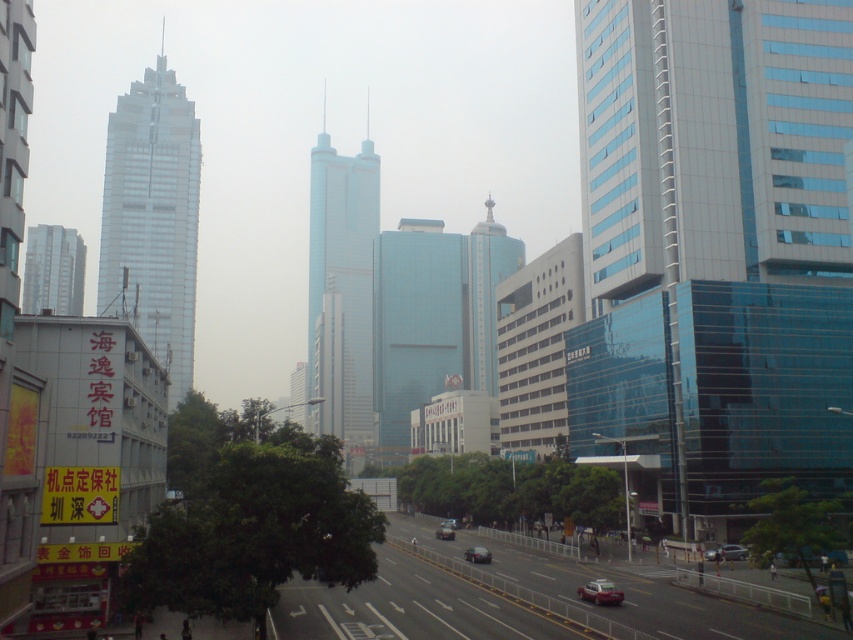
Question: Which object is closer to the camera taking this photo?

Choices:
 (A) metallic blue tower at center
 (B) glassy blue skyscraper at center
 (C) shiny black sedan at center

Answer: (C)

Question: Does smooth glass skyscraper at left have a lesser width compared to metallic red car at lower right?

Choices:
 (A) no
 (B) yes

Answer: (A)

Question: Is glassy blue skyscraper at center above shiny black sedan at center?

Choices:
 (A) yes
 (B) no

Answer: (A)

Question: Where is smooth glass skyscraper at left located in relation to metallic blue tower at center in the image?

Choices:
 (A) above
 (B) below

Answer: (A)

Question: Which object appears farthest from the camera in this image?

Choices:
 (A) metallic blue tower at center
 (B) glassy blue skyscraper at center
 (C) metallic silver car at lower right
 (D) silver metallic building at left

Answer: (A)

Question: Which point is closer to the camera?

Choices:
 (A) shiny black sedan at center
 (B) glassy blue skyscraper at center
 (C) metallic blue tower at center

Answer: (A)